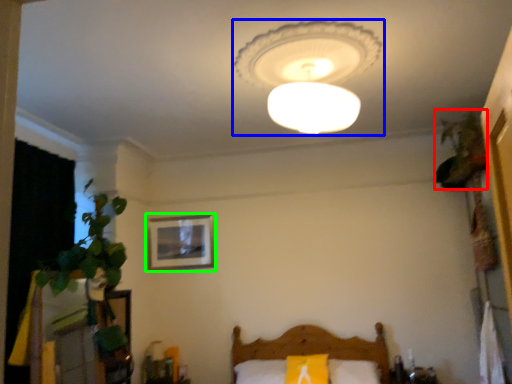
Question: Which is farther away from plant (highlighted by a red box)? lamp (highlighted by a blue box) or picture frame (highlighted by a green box)?

Choices:
 (A) lamp
 (B) picture frame

Answer: (B)